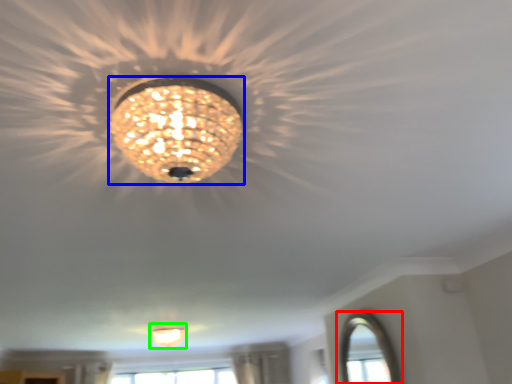
Question: Which object is the farthest from window (highlighted by a red box)? Choose among these: lamp (highlighted by a blue box) or lamp (highlighted by a green box).

Choices:
 (A) lamp
 (B) lamp

Answer: (A)